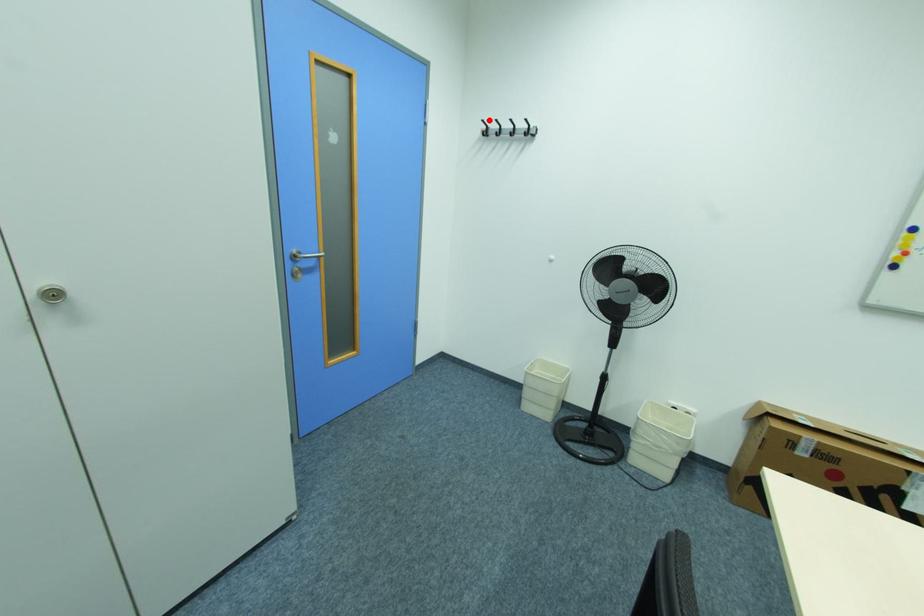
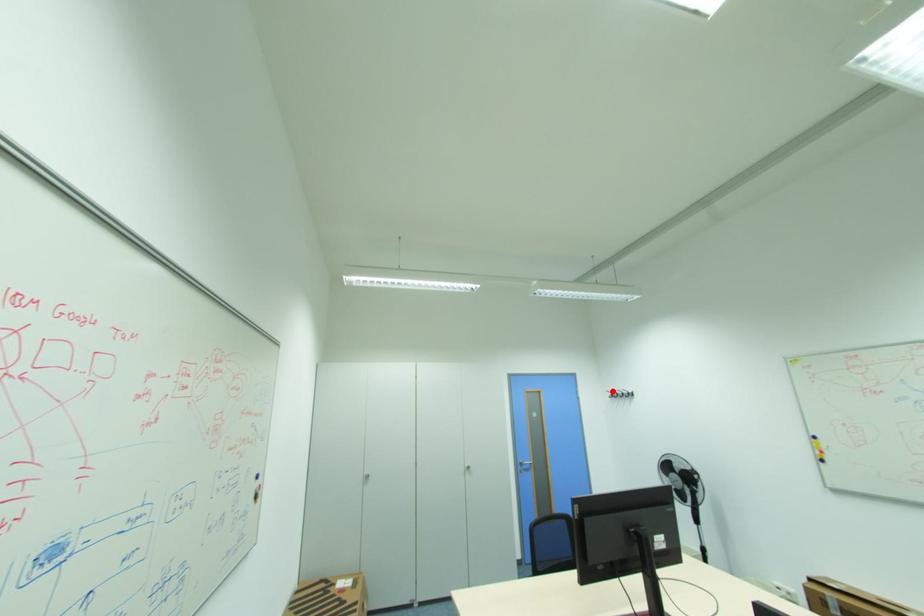
I am providing you with two images of the same scene from different viewpoints. A red point is marked on the first image and another point is marked on the second image. Do the highlighted points in image1 and image2 indicate the same real-world spot?

Yes